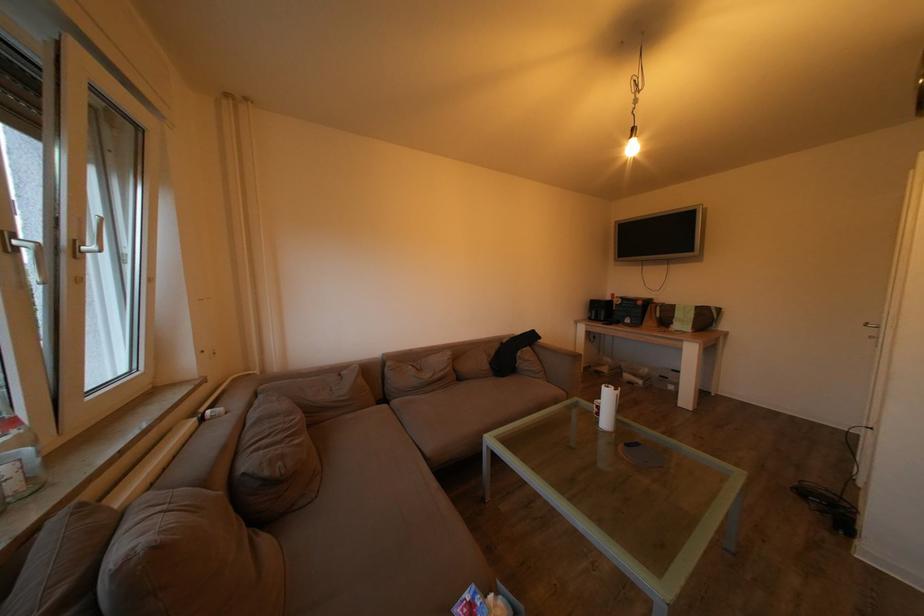
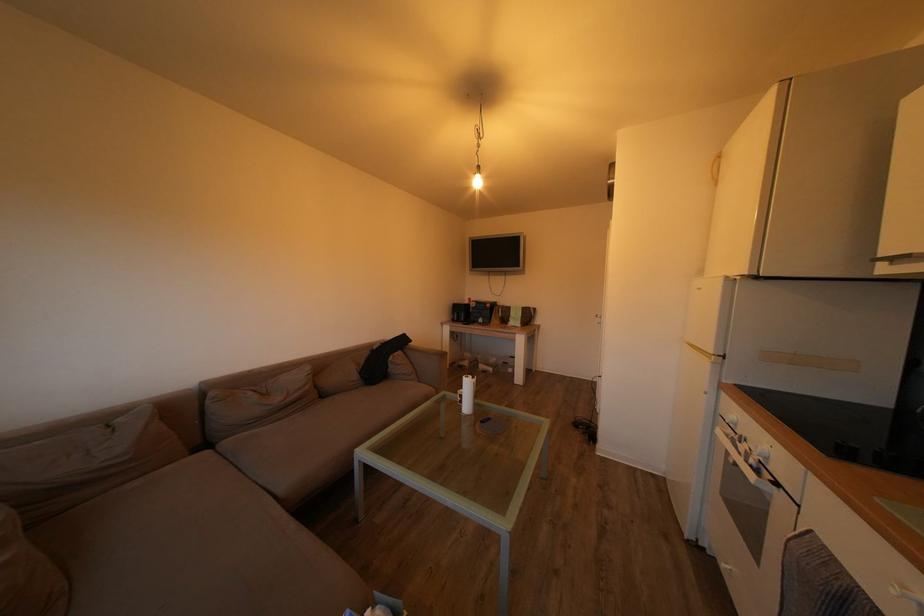
Where in the second image is the point corresponding to point (606, 414) from the first image?

(468, 402)